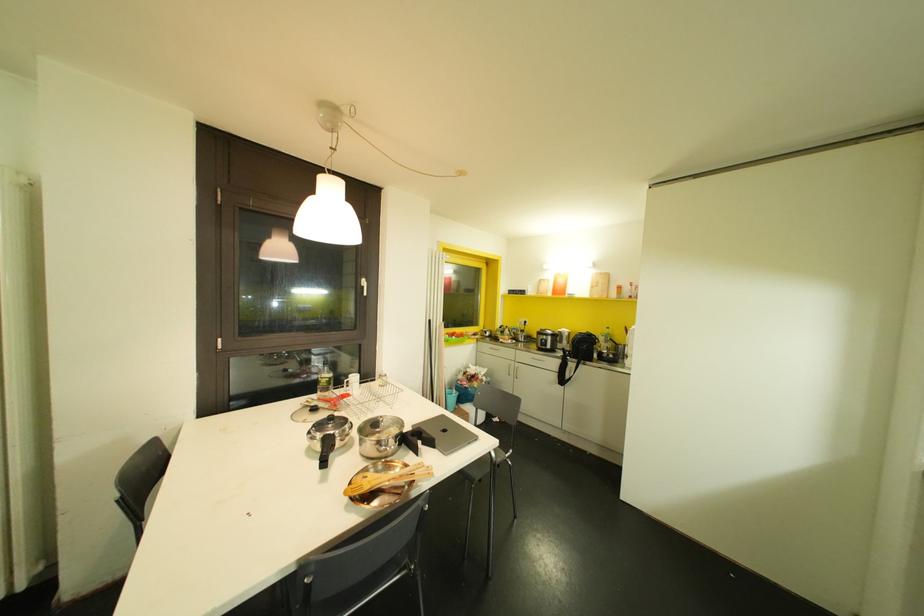
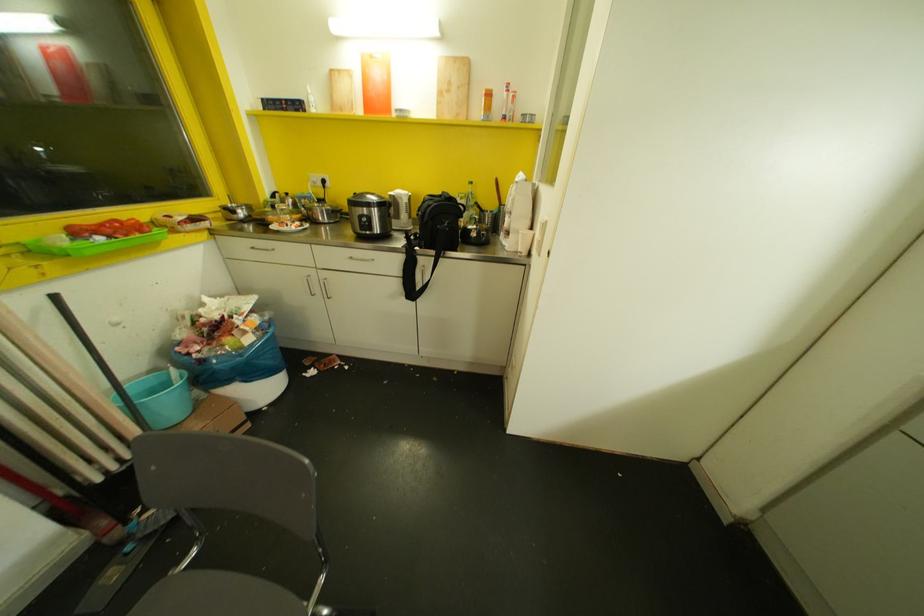
In the second image, find the point that corresponds to [561,341] in the first image.

(396, 216)